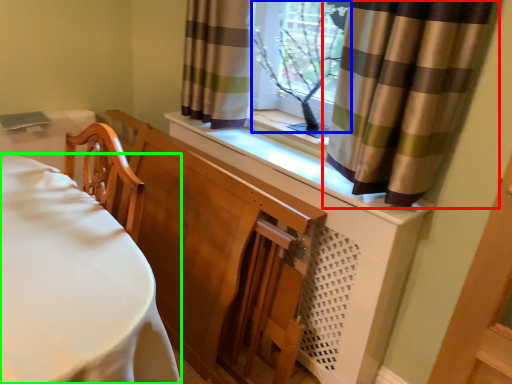
Question: Which object is positioned closest to curtain (highlighted by a red box)? Select from window frame (highlighted by a blue box) and furniture (highlighted by a green box).

Choices:
 (A) window frame
 (B) furniture

Answer: (A)